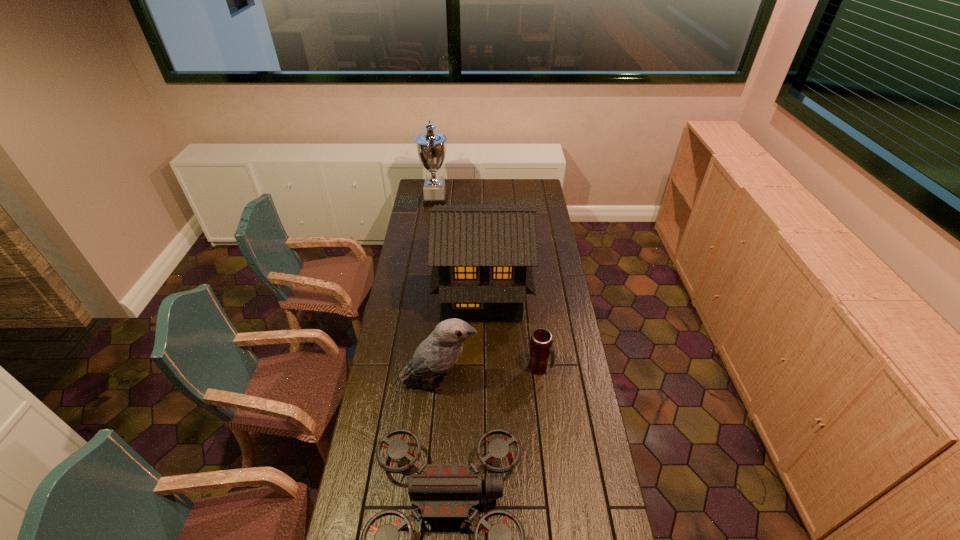
At what (x,y) coordinates should I click in order to perform the action: click on parrot at the left edge. Please return your answer as a coordinate pair (x, y). This screenshot has width=960, height=540. Looking at the image, I should click on (436, 354).

This screenshot has height=540, width=960. I want to click on object present at the right edge, so click(541, 341).

Identify the location of object that is at the far left corner. click(x=431, y=147).

The height and width of the screenshot is (540, 960). What are the coordinates of `vacant area at the far edge` in the screenshot? It's located at (483, 197).

Where is `vacant space at the left edge`? Image resolution: width=960 pixels, height=540 pixels. vacant space at the left edge is located at coordinates (373, 422).

At what (x,y) coordinates should I click in order to perform the action: click on vacant area at the right edge. Please return your answer as a coordinate pair (x, y). Looking at the image, I should click on tap(569, 316).

At what (x,y) coordinates should I click in order to perform the action: click on free space at the far right corner of the desktop. Please return your answer as a coordinate pair (x, y). The height and width of the screenshot is (540, 960). Looking at the image, I should click on (543, 179).

What are the coordinates of `free area in between the thermos bottle and the fourth nearest object` in the screenshot? It's located at (511, 331).

What are the coordinates of `empty space that is in between the dollhouse and the fourth tallest object` in the screenshot? It's located at (511, 331).

This screenshot has height=540, width=960. Identify the location of object that is the fourth closest to the thermos bottle. (431, 147).